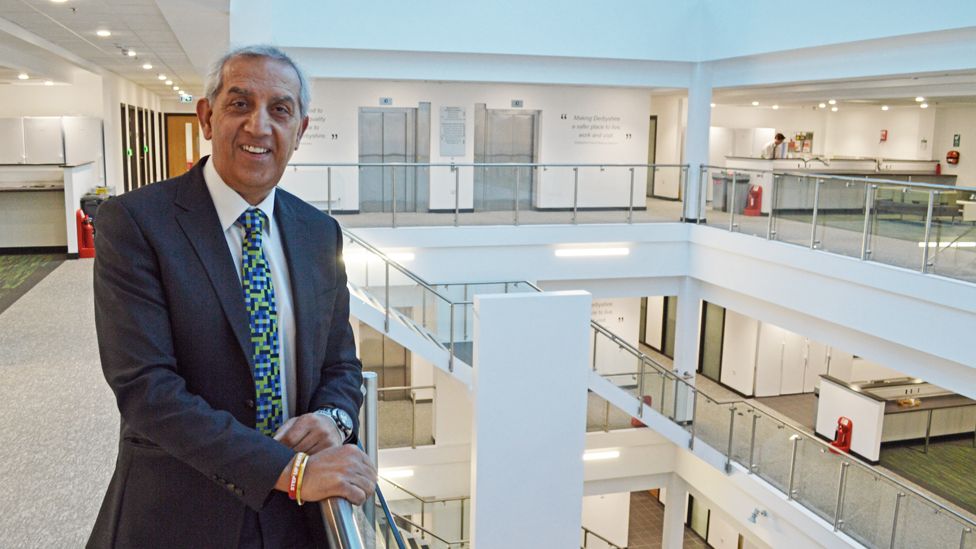
The width and height of the screenshot is (976, 549). Identify the location of stairs. (417, 336).